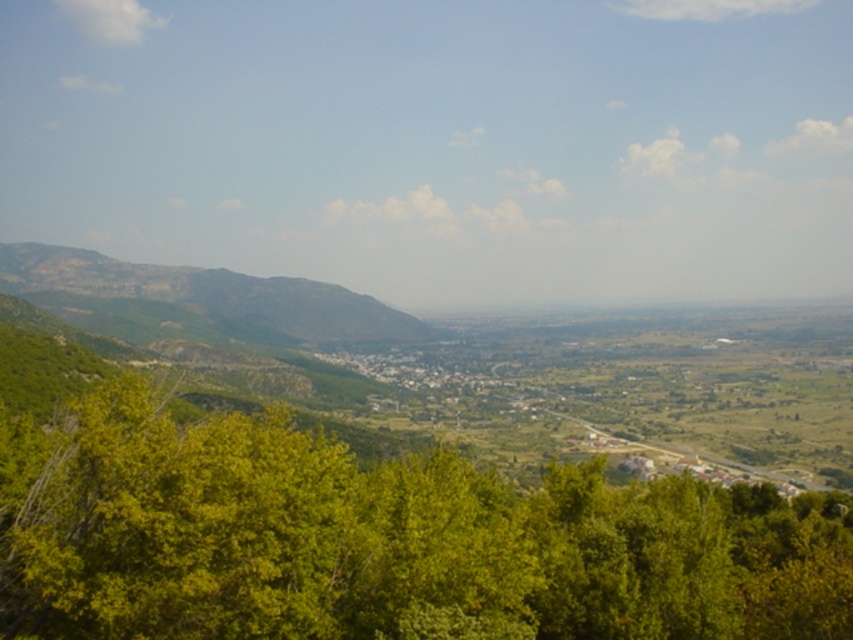
Is green leafy tree at lower center smaller than rocky brown mountain at left?

Yes, green leafy tree at lower center is smaller than rocky brown mountain at left.

Does green leafy tree at lower center have a larger size compared to rocky brown mountain at left?

No, green leafy tree at lower center is not bigger than rocky brown mountain at left.

Is point (102, 420) in front of point (54, 272)?

Yes, it is.

Where is `green leafy tree at lower center`? The width and height of the screenshot is (853, 640). green leafy tree at lower center is located at coordinates (383, 540).